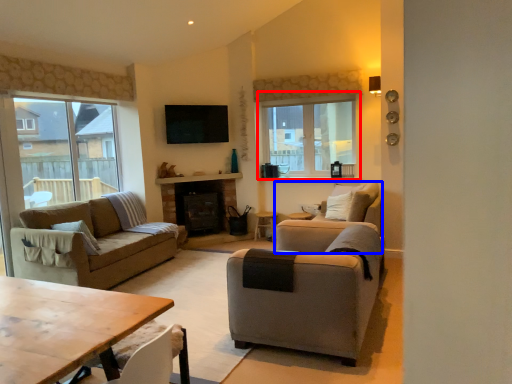
Question: Among these objects, which one is nearest to the camera, window (highlighted by a red box) or armchair (highlighted by a blue box)?

Choices:
 (A) window
 (B) armchair

Answer: (B)